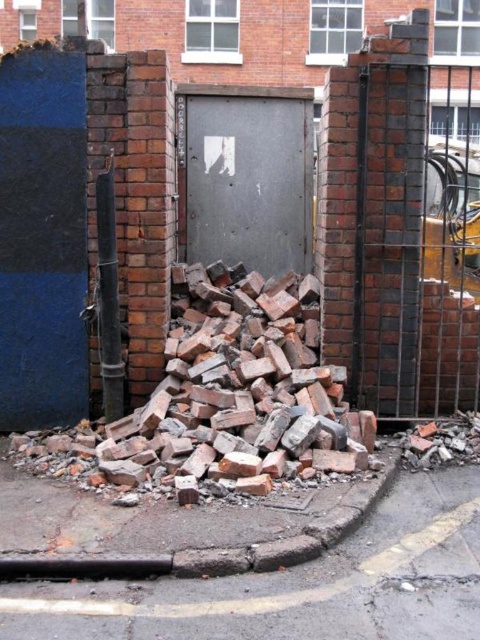
Question: Does brick fence at right appear on the left side of metallic gray door at center?

Choices:
 (A) no
 (B) yes

Answer: (A)

Question: Which point appears farthest from the camera in this image?

Choices:
 (A) pyautogui.click(x=265, y=132)
 (B) pyautogui.click(x=312, y=436)

Answer: (A)

Question: Can you confirm if brown rough pavement at lower left is positioned above metallic gray door at center?

Choices:
 (A) no
 (B) yes

Answer: (A)

Question: Which of the following is the closest to the observer?

Choices:
 (A) (415, 282)
 (B) (231, 228)
 (C) (456, 513)

Answer: (C)

Question: Is brown rough bricks at center below brick fence at right?

Choices:
 (A) yes
 (B) no

Answer: (B)

Question: Which object appears closest to the camera in this image?

Choices:
 (A) brown rough bricks at center
 (B) metallic gray door at center
 (C) brick rubble at lower center
 (D) brick fence at right

Answer: (C)